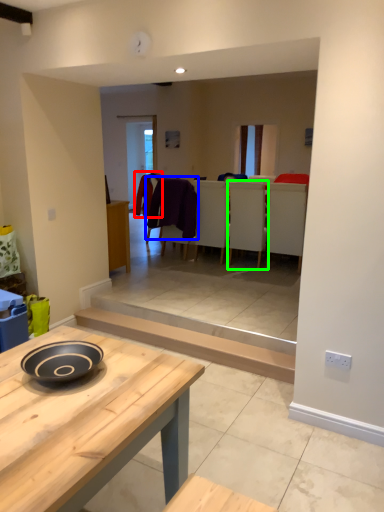
Question: Based on their relative distances, which object is farther from laundry (highlighted by a red box)? Choose from laundry (highlighted by a blue box) and chair (highlighted by a green box).

Choices:
 (A) laundry
 (B) chair

Answer: (B)